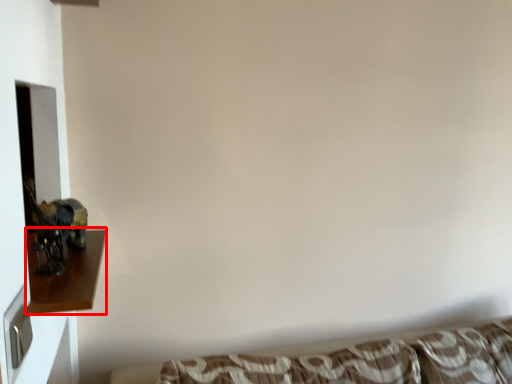
Question: From the image's perspective, where is furniture (annotated by the red box) located in relation to studio couch in the image?

Choices:
 (A) above
 (B) below

Answer: (A)